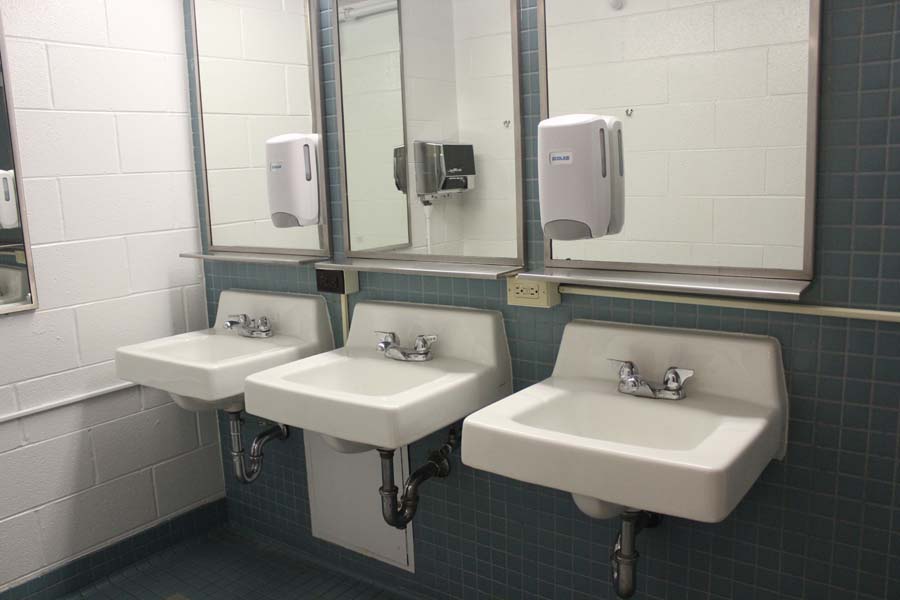
You are a GUI agent. You are given a task and a screenshot of the screen. Output one action in this format:
    pyautogui.click(x=<x>, y=<y>)
    Task: Click on the u pipe
    The image size is (900, 600).
    Given the screenshot: What is the action you would take?
    pyautogui.click(x=243, y=470), pyautogui.click(x=392, y=516), pyautogui.click(x=631, y=575)